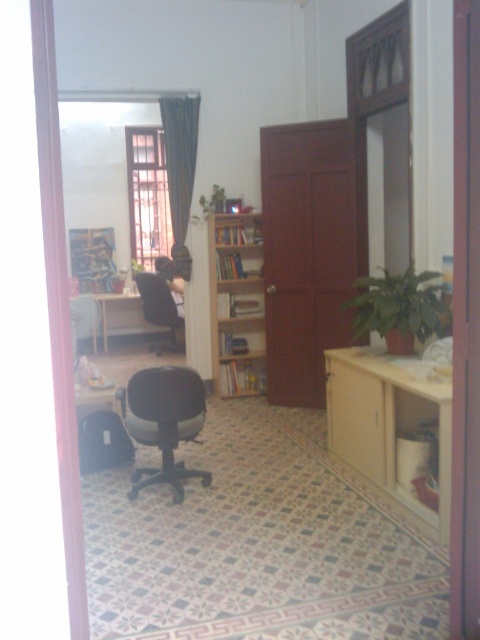
You are trying to decide whether to place a large rectangular box between the wooden cabinet at lower right and the light brown wooden bookshelf at center. Based on their widths, can you determine if there will be enough space for the box?

The wooden cabinet at lower right might be wider than light brown wooden bookshelf at center, so the total width of both objects could vary. Without knowing the exact dimensions of the box, it is uncertain if there will be enough space between them for the box.

You are arranging a small table that is 1.2 meters wide between the light brown wooden bookshelf at center and the dark green fabric curtain at upper center. Can the table fit between them without overlapping either object?

The light brown wooden bookshelf at center is wider than the dark green fabric curtain at upper center. Since the table is 1.2 meters wide, the space between them must be at least 1.2 meters. However, the description only states the bookshelf is wider, not the exact distance. Without knowing the exact dimensions of the space between them, it is impossible to determine if the table will fit.

You are a delivery person carrying a package that is 30 inches long. You need to navigate through the room shown in the image. Can you fit the package horizontally between the light brown wooden bookshelf at center and the dark green fabric curtain at upper center?

The distance between the light brown wooden bookshelf at center and the dark green fabric curtain at upper center is 28.33 inches. Since the package is 30 inches long, it is 1.67 inches too long to fit horizontally between them.